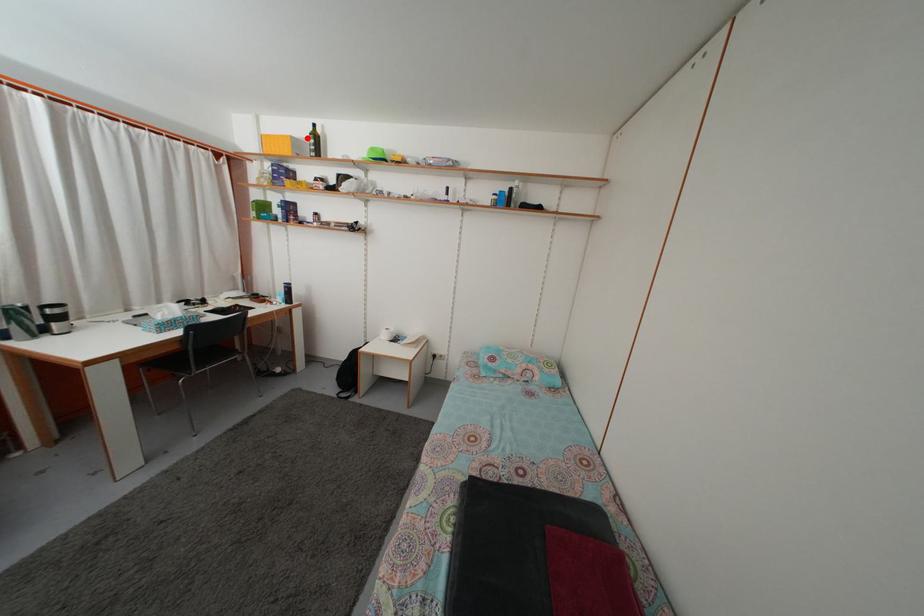
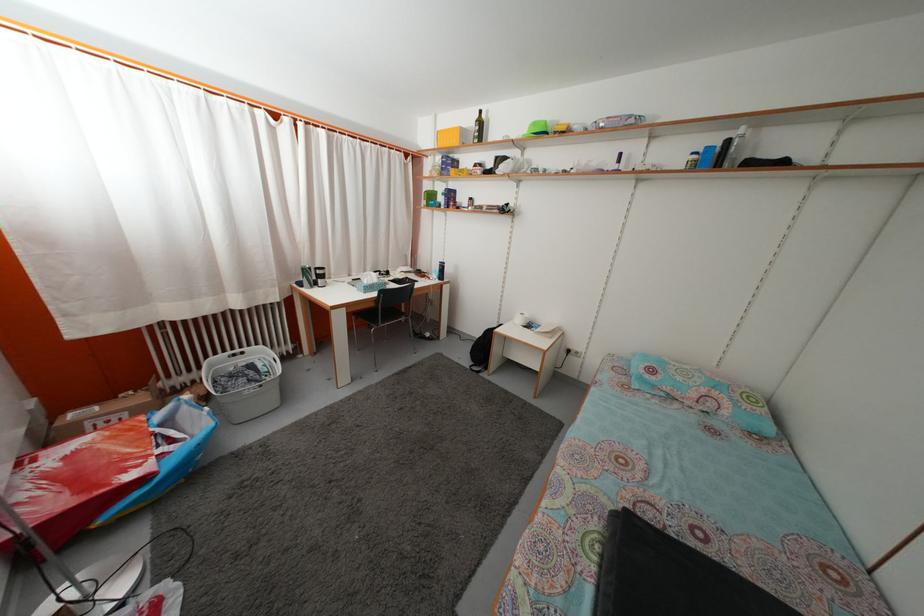
Where in the second image is the point corresponding to the highlighted location from the first image?

(475, 127)